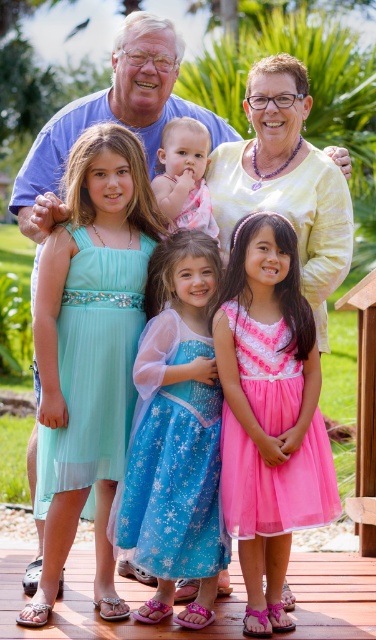
Question: Which point appears closest to the camera in this image?

Choices:
 (A) (154, 436)
 (B) (92, 292)
 (C) (280, 417)
 (D) (203, 184)

Answer: (C)

Question: Is pink tulle dress at lower center smaller than pink satin dress at center?

Choices:
 (A) yes
 (B) no

Answer: (B)

Question: Considering the real-world distances, which object is farthest from the blue satin dress at center?

Choices:
 (A) pink tulle dress at lower center
 (B) pink satin dress at center
 (C) light blue chiffon dress at center

Answer: (B)

Question: Based on their relative distances, which object is farther from the light blue chiffon dress at center?

Choices:
 (A) pink satin dress at center
 (B) pink tulle dress at lower center
 (C) blue satin dress at center

Answer: (A)

Question: Can you confirm if light blue chiffon dress at center is smaller than pink satin dress at center?

Choices:
 (A) yes
 (B) no

Answer: (B)

Question: Is blue satin dress at center closer to the viewer compared to pink satin dress at center?

Choices:
 (A) no
 (B) yes

Answer: (B)